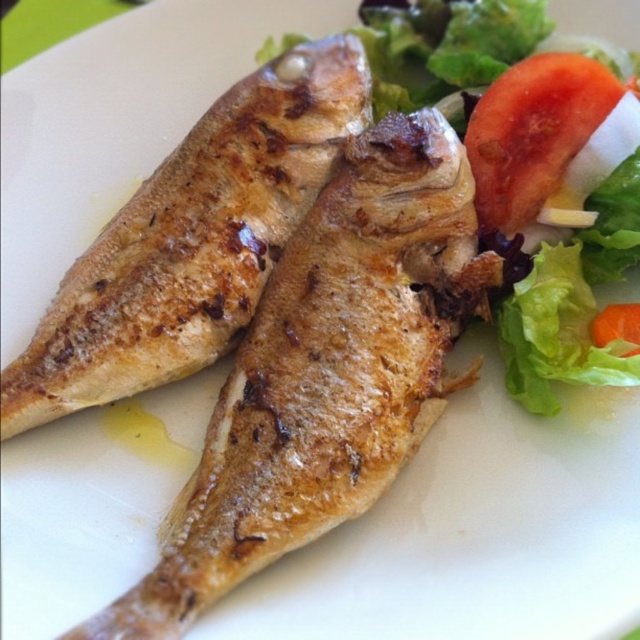
Question: Which point is farther to the camera?

Choices:
 (A) (268, 179)
 (B) (570, 188)

Answer: (A)

Question: Which point appears farthest from the camera in this image?

Choices:
 (A) (92, 285)
 (B) (636, 352)
 (C) (616, 88)

Answer: (A)

Question: Observing the image, what is the correct spatial positioning of green leafy salad at upper right in reference to orange smooth carrot at upper right?

Choices:
 (A) left
 (B) right

Answer: (A)

Question: Which object is closer to the camera taking this photo?

Choices:
 (A) brown crispy fish at center
 (B) red matte tomato at upper right

Answer: (A)

Question: Does brown crispy fish at center come in front of green leafy salad at upper right?

Choices:
 (A) no
 (B) yes

Answer: (B)

Question: Is brown crispy fish at center thinner than orange smooth carrot at upper right?

Choices:
 (A) no
 (B) yes

Answer: (A)